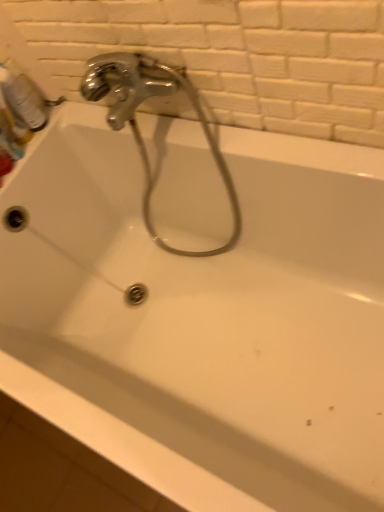
I want to click on translucent plastic mouthwash at upper left, so click(23, 98).

This screenshot has height=512, width=384. Describe the element at coordinates (23, 98) in the screenshot. I see `translucent plastic mouthwash at upper left` at that location.

Locate an element on the screen. This screenshot has width=384, height=512. chrome metallic faucet at upper left is located at coordinates (137, 126).

The height and width of the screenshot is (512, 384). What do you see at coordinates (137, 126) in the screenshot?
I see `chrome metallic faucet at upper left` at bounding box center [137, 126].

Measure the distance between chrome metallic faucet at upper left and camera.

The depth of chrome metallic faucet at upper left is 33.32 inches.

Measure the distance between point (232, 242) and camera.

1.21 meters.

The width and height of the screenshot is (384, 512). In order to click on translucent plastic mouthwash at upper left in this screenshot , I will do `click(23, 98)`.

Is translucent plastic mouthwash at upper left at the left side of chrome metallic faucet at upper left?

Yes.

Looking at this image, which is in front, translucent plastic mouthwash at upper left or chrome metallic faucet at upper left?

Positioned in front is chrome metallic faucet at upper left.

Considering the positions of point (37, 106) and point (141, 66), is point (37, 106) closer or farther from the camera than point (141, 66)?

Point (37, 106) appears to be farther away from the viewer than point (141, 66).

From the image's perspective, would you say translucent plastic mouthwash at upper left is shown under chrome metallic faucet at upper left?

No.

From a real-world perspective, is translucent plastic mouthwash at upper left above or below chrome metallic faucet at upper left?

translucent plastic mouthwash at upper left is situated higher than chrome metallic faucet at upper left in the real world.

Which object is wider, translucent plastic mouthwash at upper left or chrome metallic faucet at upper left?

Wider between the two is chrome metallic faucet at upper left.

From the picture: Considering the sizes of objects translucent plastic mouthwash at upper left and chrome metallic faucet at upper left in the image provided, who is taller, translucent plastic mouthwash at upper left or chrome metallic faucet at upper left?

Standing taller between the two is chrome metallic faucet at upper left.

From the picture: Between translucent plastic mouthwash at upper left and chrome metallic faucet at upper left, which one has larger size?

chrome metallic faucet at upper left is bigger.

Is chrome metallic faucet at upper left inside translucent plastic mouthwash at upper left?

No, translucent plastic mouthwash at upper left does not contain chrome metallic faucet at upper left.

Is translucent plastic mouthwash at upper left far away from chrome metallic faucet at upper left?

Actually, translucent plastic mouthwash at upper left and chrome metallic faucet at upper left are a little close together.

Could you tell me if translucent plastic mouthwash at upper left is turned towards chrome metallic faucet at upper left?

Yes, translucent plastic mouthwash at upper left faces towards chrome metallic faucet at upper left.

Could you measure the distance between translucent plastic mouthwash at upper left and chrome metallic faucet at upper left?

translucent plastic mouthwash at upper left is 33.79 centimeters from chrome metallic faucet at upper left.

At what (x,y) coordinates should I click in order to perform the action: click on plumbing fixture in front of the translucent plastic mouthwash at upper left. Please return your answer as a coordinate pair (x, y). The width and height of the screenshot is (384, 512). Looking at the image, I should click on (137, 126).

Which object is positioned more to the left, chrome metallic faucet at upper left or translucent plastic mouthwash at upper left?

Positioned to the left is translucent plastic mouthwash at upper left.

Which object is further away from the camera, chrome metallic faucet at upper left or translucent plastic mouthwash at upper left?

translucent plastic mouthwash at upper left is behind.

Considering the points (233, 230) and (40, 111), which point is in front, point (233, 230) or point (40, 111)?

Positioned in front is point (40, 111).

From the image's perspective, which object appears higher, chrome metallic faucet at upper left or translucent plastic mouthwash at upper left?

translucent plastic mouthwash at upper left appears higher in the image.

From a real-world perspective, is chrome metallic faucet at upper left under translucent plastic mouthwash at upper left?

Yes, from a real-world perspective, chrome metallic faucet at upper left is under translucent plastic mouthwash at upper left.

Considering the relative sizes of chrome metallic faucet at upper left and translucent plastic mouthwash at upper left in the image provided, is chrome metallic faucet at upper left wider than translucent plastic mouthwash at upper left?

Indeed, chrome metallic faucet at upper left has a greater width compared to translucent plastic mouthwash at upper left.

Considering the sizes of chrome metallic faucet at upper left and translucent plastic mouthwash at upper left in the image, is chrome metallic faucet at upper left taller or shorter than translucent plastic mouthwash at upper left?

Considering their sizes, chrome metallic faucet at upper left has more height than translucent plastic mouthwash at upper left.

Is chrome metallic faucet at upper left bigger or smaller than translucent plastic mouthwash at upper left?

Considering their sizes, chrome metallic faucet at upper left takes up more space than translucent plastic mouthwash at upper left.

Which is correct: chrome metallic faucet at upper left is inside translucent plastic mouthwash at upper left, or outside of it?

chrome metallic faucet at upper left is not enclosed by translucent plastic mouthwash at upper left.

Is chrome metallic faucet at upper left with translucent plastic mouthwash at upper left?

No, chrome metallic faucet at upper left is not in contact with translucent plastic mouthwash at upper left.

Is chrome metallic faucet at upper left oriented away from translucent plastic mouthwash at upper left?

That's not correct — chrome metallic faucet at upper left is not looking away from translucent plastic mouthwash at upper left.

Can you tell me how much chrome metallic faucet at upper left and translucent plastic mouthwash at upper left differ in facing direction?

There is a 90.5-degree angle between the facing directions of chrome metallic faucet at upper left and translucent plastic mouthwash at upper left.

Where is `mouthwash that is above the chrome metallic faucet at upper left (from a real-world perspective)`? mouthwash that is above the chrome metallic faucet at upper left (from a real-world perspective) is located at coordinates (23, 98).

Image resolution: width=384 pixels, height=512 pixels. I want to click on mouthwash behind the chrome metallic faucet at upper left, so 23,98.

Identify the location of plumbing fixture below the translucent plastic mouthwash at upper left (from the image's perspective). (137, 126).